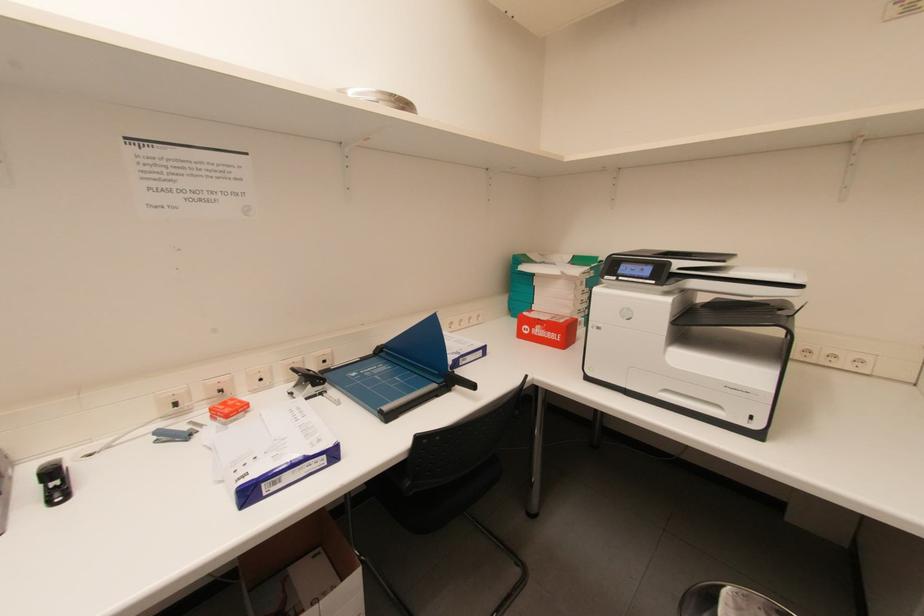
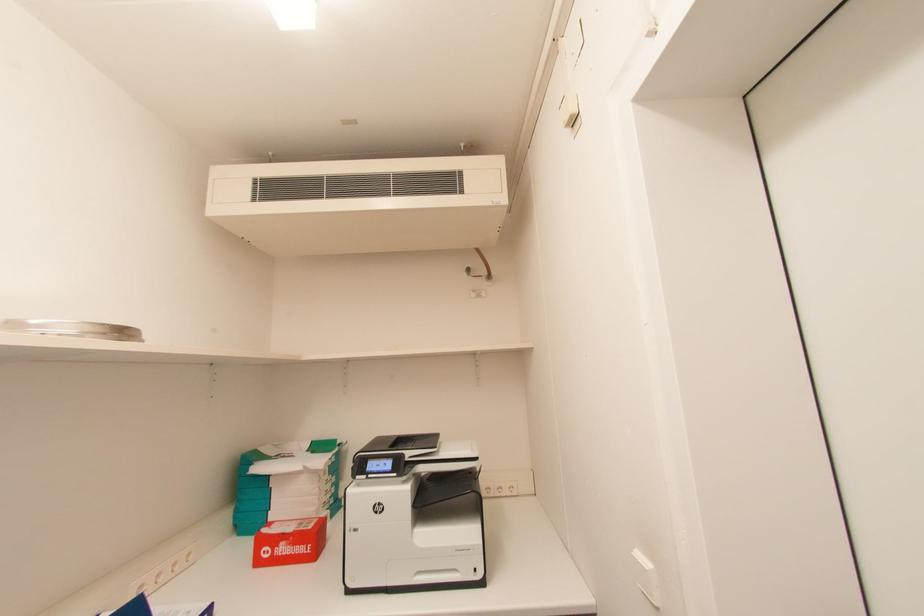
First-person continuous shooting, in which direction is the camera rotating?

The camera's rotation is toward right-up.